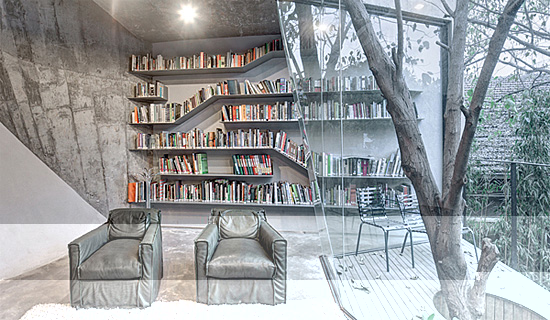
Find the location of a particular element. This screenshot has width=550, height=320. book is located at coordinates (233, 87).